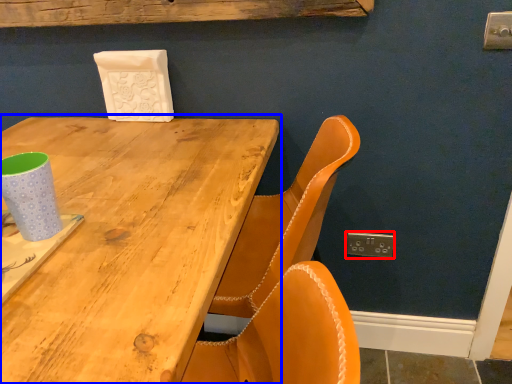
Question: Which point is closer to the camera, electric outlet (highlighted by a red box) or table (highlighted by a blue box)?

Choices:
 (A) electric outlet
 (B) table

Answer: (B)